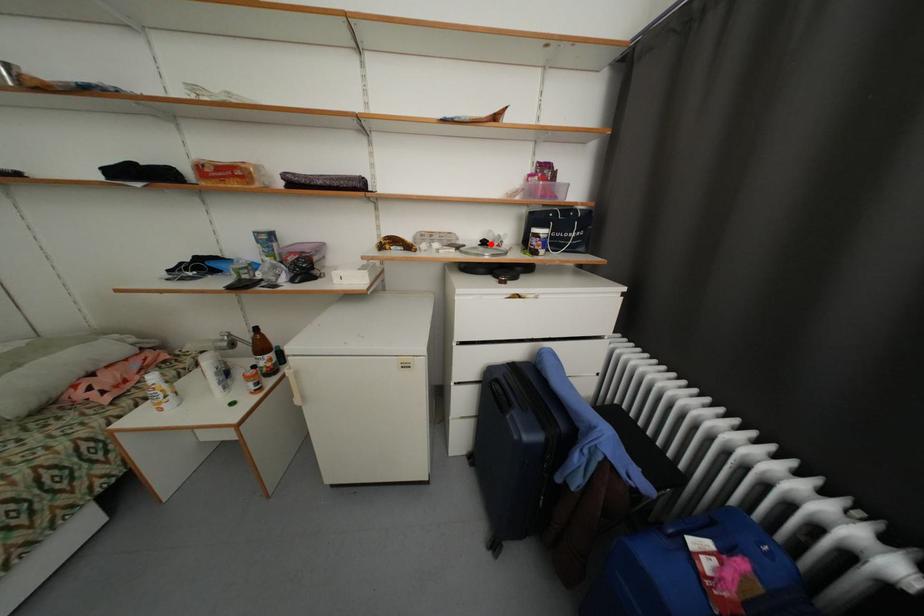
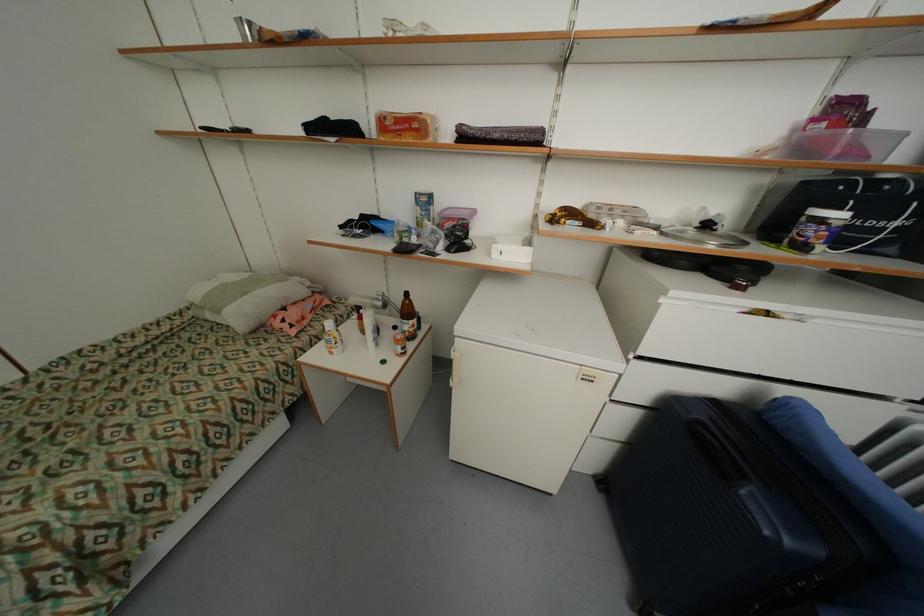
Where in the second image is the point corresponding to the highlighted location from the first image?

(713, 227)